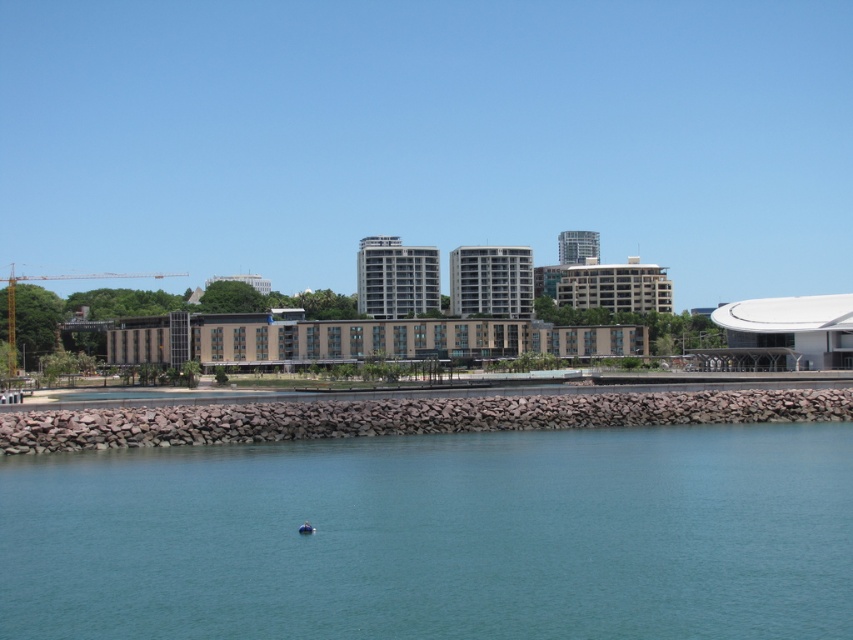
Question: Which point is farther to the camera?

Choices:
 (A) (344, 538)
 (B) (306, 524)

Answer: (B)

Question: Can you confirm if clear blue water at center is wider than blue rubber boat at lower center?

Choices:
 (A) yes
 (B) no

Answer: (A)

Question: Does clear blue water at center have a greater width compared to blue rubber boat at lower center?

Choices:
 (A) no
 (B) yes

Answer: (B)

Question: Where is clear blue water at center located in relation to blue rubber boat at lower center in the image?

Choices:
 (A) below
 (B) above

Answer: (A)